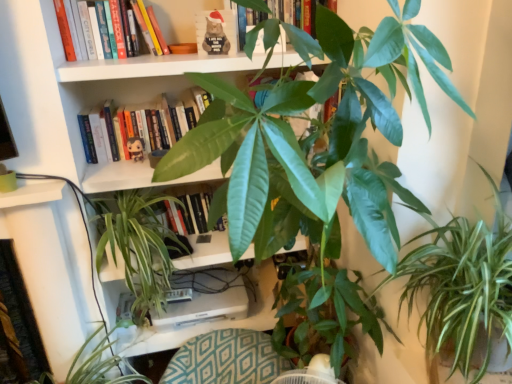
Question: From a real-world perspective, is green leafy plant at lower right positioned under hardcover book at upper center, the third book when ordered from bottom to top, based on gravity?

Choices:
 (A) no
 (B) yes

Answer: (B)

Question: Can we say green leafy plant at lower right lies outside hardcover book at upper center, the third book when ordered from bottom to top?

Choices:
 (A) yes
 (B) no

Answer: (A)

Question: Does green leafy plant at lower right have a lesser height compared to hardcover book at upper center, the third book when ordered from bottom to top?

Choices:
 (A) no
 (B) yes

Answer: (B)

Question: Does green leafy plant at lower right have a greater height compared to hardcover book at upper center, which ranks as the first book in top-to-bottom order?

Choices:
 (A) no
 (B) yes

Answer: (A)

Question: From the image's perspective, does green leafy plant at lower right appear higher than hardcover book at upper center, the third book when ordered from bottom to top?

Choices:
 (A) yes
 (B) no

Answer: (B)

Question: Is green leafy plant at lower right oriented away from hardcover book at upper center, which ranks as the first book in top-to-bottom order?

Choices:
 (A) no
 (B) yes

Answer: (A)

Question: Does green glossy plant at center, which ranks as the second houseplant in left-to-right order, have a greater width compared to green leafy plant at lower left, the third houseplant in the right-to-left sequence?

Choices:
 (A) yes
 (B) no

Answer: (A)

Question: Does green glossy plant at center, the 2th houseplant in the right-to-left sequence, have a greater height compared to green leafy plant at lower left, the third houseplant in the right-to-left sequence?

Choices:
 (A) yes
 (B) no

Answer: (A)

Question: Can you confirm if green glossy plant at center, which ranks as the second houseplant in left-to-right order, is shorter than green leafy plant at lower left, the 1th houseplant from the left?

Choices:
 (A) no
 (B) yes

Answer: (A)

Question: Are green glossy plant at center, the 2th houseplant in the right-to-left sequence, and green leafy plant at lower left, the third houseplant in the right-to-left sequence, located far from each other?

Choices:
 (A) no
 (B) yes

Answer: (A)

Question: Is the depth of green glossy plant at center, which ranks as the second houseplant in left-to-right order, less than that of green leafy plant at lower left, the 1th houseplant from the left?

Choices:
 (A) yes
 (B) no

Answer: (B)

Question: Is green leafy plant at lower left, the third houseplant in the right-to-left sequence, located within green glossy plant at center, the 2th houseplant in the right-to-left sequence?

Choices:
 (A) no
 (B) yes

Answer: (A)

Question: Is matte black plush toy at upper center shorter than green leafy plant at lower right?

Choices:
 (A) no
 (B) yes

Answer: (B)